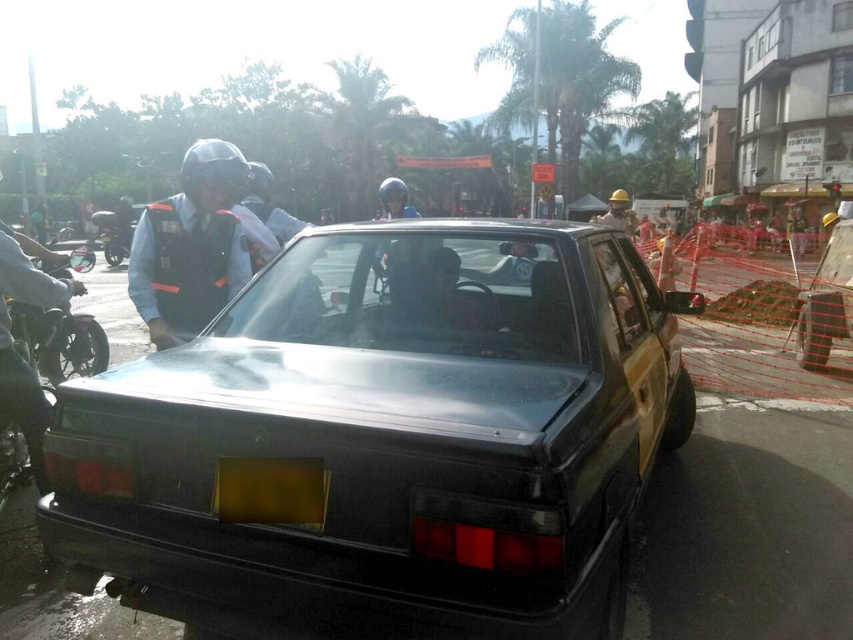
The width and height of the screenshot is (853, 640). What are the coordinates of `matte black helmet at upper left` in the screenshot? It's located at pyautogui.click(x=190, y=246).

Looking at this image, measure the distance from matte black helmet at upper left to hard hat at center.

matte black helmet at upper left is 10.56 meters from hard hat at center.

Measure the distance between matte black helmet at upper left and camera.

3.18 meters

Locate an element on the screen. This screenshot has height=640, width=853. matte black helmet at upper left is located at coordinates (190, 246).

Describe the element at coordinates (393, 429) in the screenshot. I see `black matte car at center` at that location.

Is black matte car at center shorter than yellow matte license plate at center?

Incorrect, black matte car at center's height does not fall short of yellow matte license plate at center's.

Is point (97, 413) behind point (252, 484)?

That is True.

You are a GUI agent. You are given a task and a screenshot of the screen. Output one action in this format:
    pyautogui.click(x=<x>, y=<y>)
    Task: Click on the black matte car at center
    This screenshot has width=853, height=640.
    Given the screenshot: What is the action you would take?
    393,429

Does matte black helmet at left come in front of hard hat at center?

Yes, it is in front of hard hat at center.

The width and height of the screenshot is (853, 640). What do you see at coordinates (25, 259) in the screenshot?
I see `matte black helmet at left` at bounding box center [25, 259].

Who is more forward, (26, 408) or (614, 205)?

Point (26, 408) is more forward.

You are a GUI agent. You are given a task and a screenshot of the screen. Output one action in this format:
    pyautogui.click(x=<x>, y=<y>)
    Task: Click on the matte black helmet at left
    
    Given the screenshot: What is the action you would take?
    pyautogui.click(x=25, y=259)